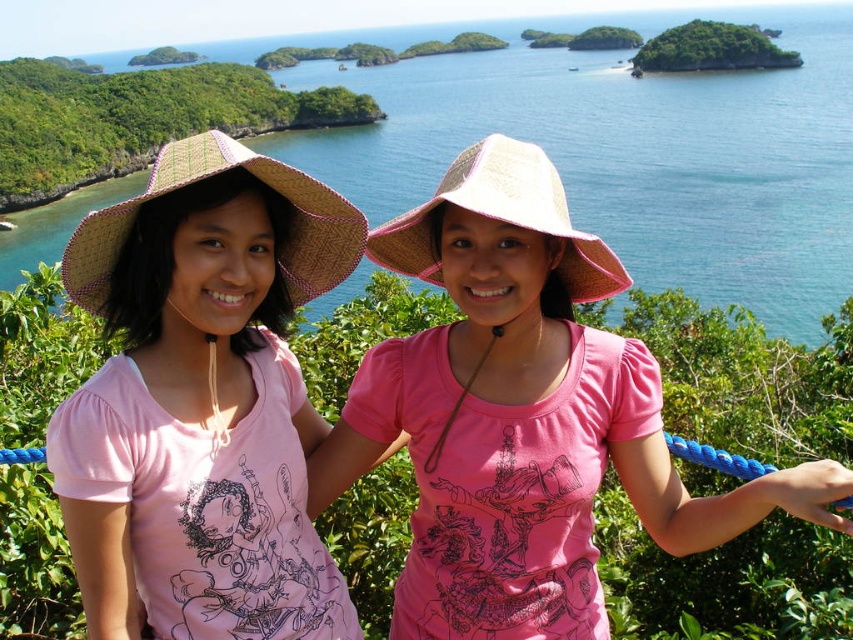
Question: Is strawtexturehat at left to the right of straw hat at center from the viewer's perspective?

Choices:
 (A) yes
 (B) no

Answer: (B)

Question: Is strawtexturehat at left below straw hat at center?

Choices:
 (A) yes
 (B) no

Answer: (B)

Question: Which object appears closest to the camera in this image?

Choices:
 (A) green leafy island at upper center
 (B) straw hat at center

Answer: (B)

Question: Which object appears closest to the camera in this image?

Choices:
 (A) green leafy vegetation at upper left
 (B) straw hat at center
 (C) strawtexturehat at left

Answer: (C)

Question: Estimate the real-world distances between objects in this image. Which object is closer to the strawtexturehat at left?

Choices:
 (A) matte straw hat at center
 (B) green leafy island at upper center

Answer: (A)

Question: From the image, what is the correct spatial relationship of strawtexturehat at left in relation to green leafy island at upper center?

Choices:
 (A) right
 (B) left

Answer: (B)